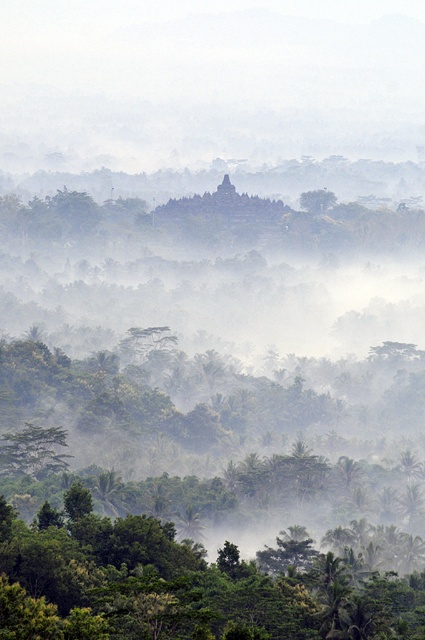
Consider the image. You are standing in a misty forest and want to reach a specific point. The coordinates of the point you need to reach are point (x=345, y=556). Given that your current position is 500 feet away from this point, can you safely walk towards it without getting lost?

The distance of point (x=345, y=556) from viewer is 706.07 feet, so you are currently 500 feet away from it. This means you still need to walk 206.07 feet to reach the point. However, the thick mist in the midground may obscure visibility, making it difficult to navigate accurately. Proceed with caution and use landmarks if possible.

You are standing in the misty forest and see the green leafy tree at lower center and the green leafy tree at lower left. Which tree is closer to you?

The green leafy tree at lower center is closer to you because it is located below the green leafy tree at lower left, indicating it is in a lower position in the scene.